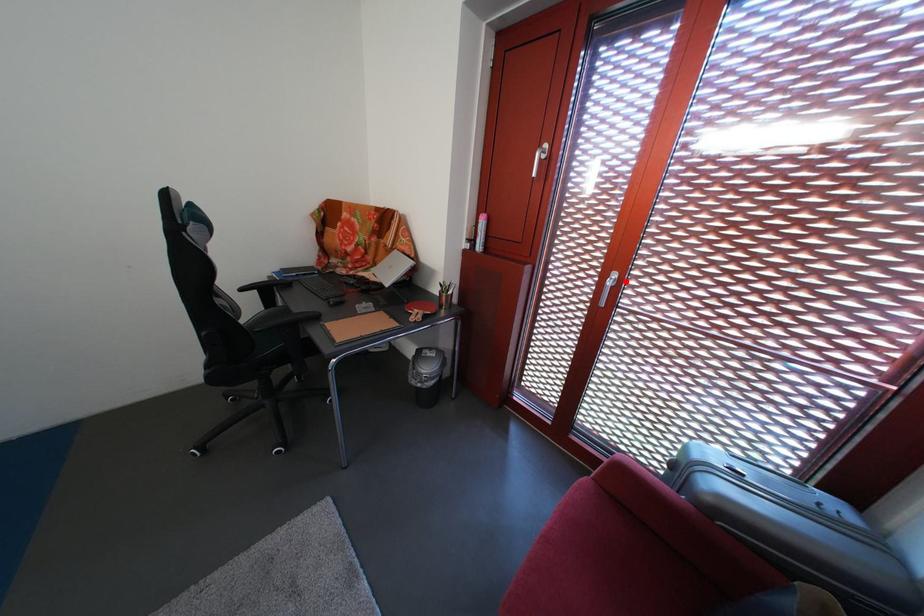
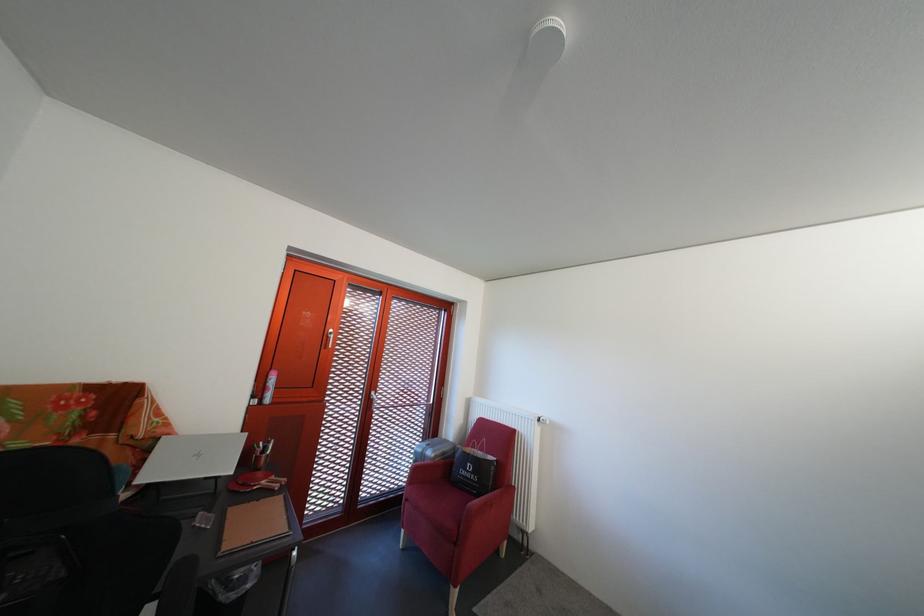
The point at the highlighted location is marked in the first image. Where is the corresponding point in the second image?

(383, 400)